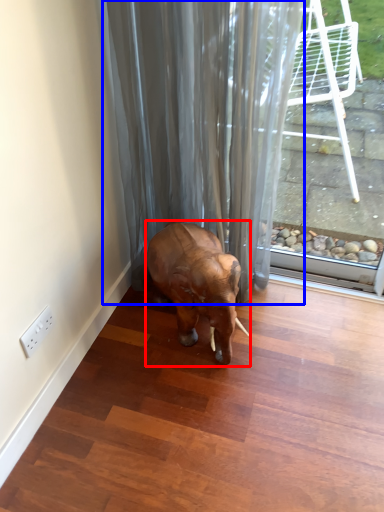
Question: Which object appears closest to the camera in this image, elephant (highlighted by a red box) or shower curtain (highlighted by a blue box)?

Choices:
 (A) elephant
 (B) shower curtain

Answer: (B)